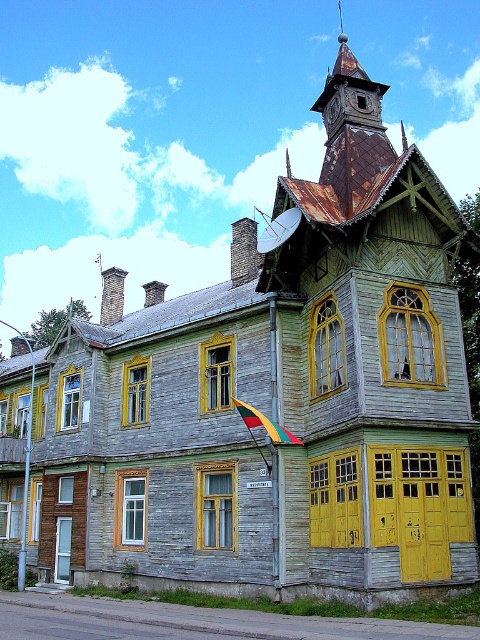
Can you confirm if rusty metal spire at upper center is bigger than tri-colored fabric flag at center?

Yes, rusty metal spire at upper center is bigger than tri-colored fabric flag at center.

Is rusty metal spire at upper center closer to the viewer compared to tri-colored fabric flag at center?

Yes, rusty metal spire at upper center is closer to the viewer.

The height and width of the screenshot is (640, 480). In order to click on rusty metal spire at upper center in this screenshot , I will do `click(351, 145)`.

The height and width of the screenshot is (640, 480). I want to click on rusty metal spire at upper center, so (351, 145).